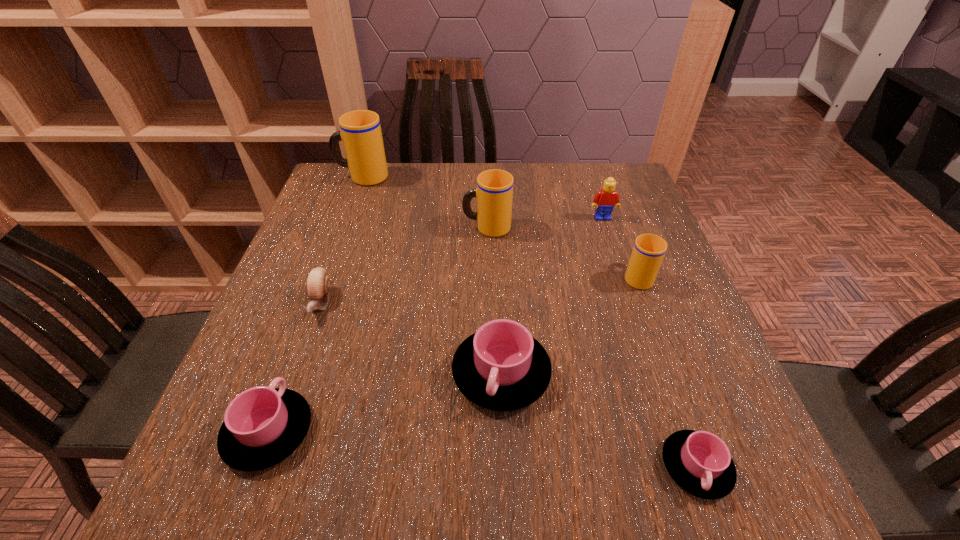
You are a GUI agent. You are given a task and a screenshot of the screen. Output one action in this format:
    pyautogui.click(x=<x>, y=<y>)
    Task: Click on the second shortest cup
    This screenshot has height=540, width=960.
    Given the screenshot: What is the action you would take?
    pyautogui.click(x=263, y=425)

Find the location of a particular element. The height and width of the screenshot is (540, 960). escargot is located at coordinates (318, 282).

The image size is (960, 540). What are the coordinates of `the shortest object` in the screenshot? It's located at (699, 462).

This screenshot has height=540, width=960. I want to click on the rightmost pink cup, so click(699, 462).

Locate an element on the screen. The image size is (960, 540). vacant space located 0.390m on the side of the second nearest beige cup with the handle is located at coordinates (310, 227).

At what (x,y) coordinates should I click in order to perform the action: click on free space located on the side of the second nearest beige cup with the handle. Please return your answer as a coordinate pair (x, y). This screenshot has width=960, height=540. Looking at the image, I should click on (376, 227).

The height and width of the screenshot is (540, 960). I want to click on free space located 0.050m on the side of the second nearest beige cup with the handle, so click(444, 227).

Locate an element on the screen. This screenshot has height=540, width=960. vacant area located 0.050m on the front-facing side of the Lego is located at coordinates (608, 233).

This screenshot has height=540, width=960. I want to click on free region located 0.270m on the side of the third tallest cup with the handle, so pos(609,197).

The height and width of the screenshot is (540, 960). I want to click on vacant space situated 0.080m on the side of the third tallest cup with the handle, so click(624, 241).